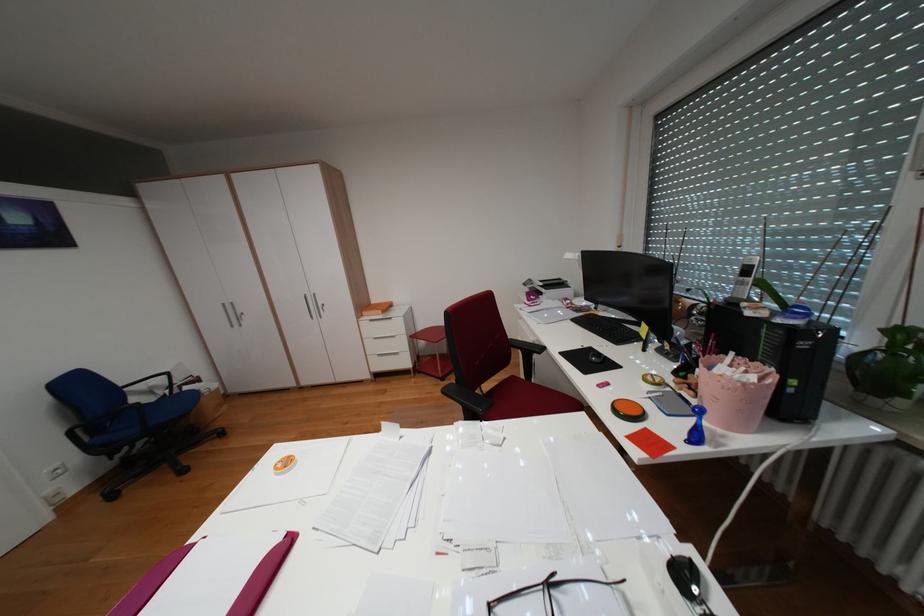
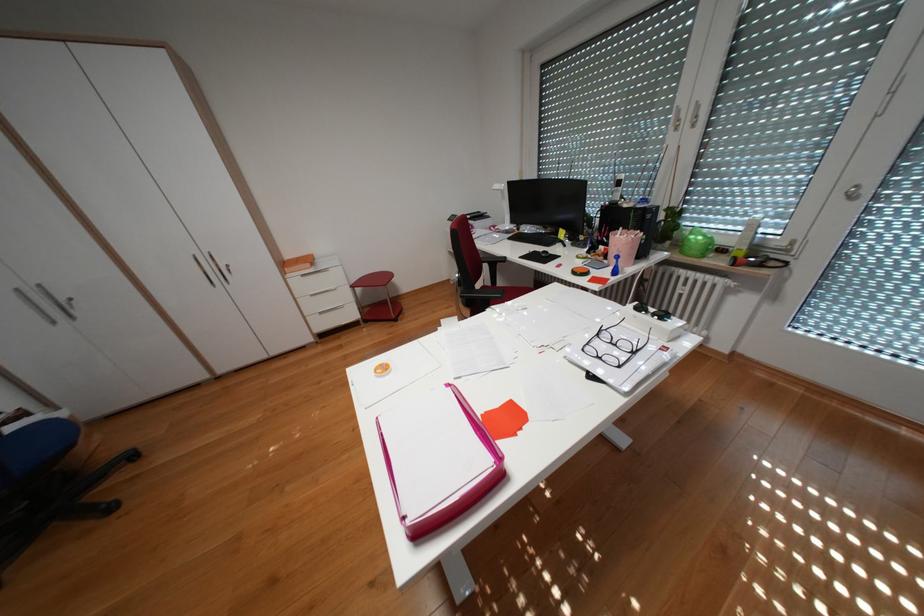
Where in the second image is the point corresponding to point (392, 315) from the first image?

(324, 270)